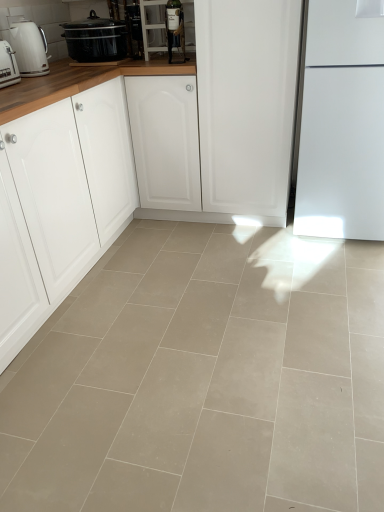
How much space does matte glass wine bottle at upper center, which ranks as the second appliance in left-to-right order, occupy horizontally?

matte glass wine bottle at upper center, which ranks as the second appliance in left-to-right order, is 5.81 inches wide.

This screenshot has height=512, width=384. Identify the location of matte black slow cooker at upper left. (96, 39).

This screenshot has width=384, height=512. What do you see at coordinates (72, 181) in the screenshot? I see `white matte cabinet at left` at bounding box center [72, 181].

In order to click on white glossy kettle at left, the 1th kitchen appliance from the back in this screenshot , I will do `click(29, 47)`.

Is matte glass wine bottle at upper center, which ranks as the second appliance in left-to-right order, far away from matte black slow cooker at upper left?

No, matte glass wine bottle at upper center, which ranks as the second appliance in left-to-right order, is in close proximity to matte black slow cooker at upper left.

Identify the location of appliance in front of the matte black slow cooker at upper left. Image resolution: width=384 pixels, height=512 pixels. (175, 28).

Is matte glass wine bottle at upper center, arranged as the second appliance when viewed from the back, facing away from matte black slow cooker at upper left?

That's not correct — matte glass wine bottle at upper center, arranged as the second appliance when viewed from the back, is not looking away from matte black slow cooker at upper left.

Measure the distance between matte glass wine bottle at upper center, placed as the 1th appliance when sorted from right to left, and matte black slow cooker at upper left.

matte glass wine bottle at upper center, placed as the 1th appliance when sorted from right to left, and matte black slow cooker at upper left are 15.88 inches apart from each other.

Identify the location of the 2nd kitchen appliance above the beige tile floor at center (from the image's perspective). (29, 47).

Does beige tile floor at center appear on the right side of white glossy kettle at left, the 1th kitchen appliance from the back?

Correct, you'll find beige tile floor at center to the right of white glossy kettle at left, the 1th kitchen appliance from the back.

Is beige tile floor at center in contact with white glossy kettle at left, arranged as the second kitchen appliance when viewed from the front?

beige tile floor at center and white glossy kettle at left, arranged as the second kitchen appliance when viewed from the front, are not in contact.

Consider the image. Considering the sizes of objects matte glass wine bottle at upper center, placed as the 1th appliance when sorted from right to left, and metallic glass bottle at upper center, placed as the 1th appliance when sorted from back to front, in the image provided, who is smaller, matte glass wine bottle at upper center, placed as the 1th appliance when sorted from right to left, or metallic glass bottle at upper center, placed as the 1th appliance when sorted from back to front,?

Smaller between the two is metallic glass bottle at upper center, placed as the 1th appliance when sorted from back to front.

Considering the sizes of objects matte glass wine bottle at upper center, placed as the 1th appliance when sorted from right to left, and metallic glass bottle at upper center, the 1th appliance when ordered from left to right, in the image provided, who is thinner, matte glass wine bottle at upper center, placed as the 1th appliance when sorted from right to left, or metallic glass bottle at upper center, the 1th appliance when ordered from left to right,?

metallic glass bottle at upper center, the 1th appliance when ordered from left to right, is thinner.

Locate an element on the screen. This screenshot has height=512, width=384. appliance on the right of metallic glass bottle at upper center, the 1th appliance when ordered from left to right is located at coordinates (175, 28).

Can you confirm if matte glass wine bottle at upper center, the first appliance viewed from the front, is taller than metallic glass bottle at upper center, the 1th appliance when ordered from left to right?

Yes.

Does beige tile floor at center appear on the left side of white plastic toaster at left, arranged as the 1th kitchen appliance when viewed from the front?

In fact, beige tile floor at center is to the right of white plastic toaster at left, arranged as the 1th kitchen appliance when viewed from the front.

Consider the image. How different are the orientations of beige tile floor at center and white plastic toaster at left, arranged as the 1th kitchen appliance when viewed from the front, in degrees?

91.3 degrees separate the facing orientations of beige tile floor at center and white plastic toaster at left, arranged as the 1th kitchen appliance when viewed from the front.

Who is more distant, beige tile floor at center or white plastic toaster at left, placed as the 2th kitchen appliance when sorted from back to front?

white plastic toaster at left, placed as the 2th kitchen appliance when sorted from back to front, is further away from the camera.

Which of these two, beige tile floor at center or white plastic toaster at left, placed as the 2th kitchen appliance when sorted from back to front, is smaller?

white plastic toaster at left, placed as the 2th kitchen appliance when sorted from back to front, is smaller.

From the image's perspective, would you say white plastic toaster at left, arranged as the 1th kitchen appliance when viewed from the front, is shown under matte black slow cooker at upper left?

Indeed, from the image's perspective, white plastic toaster at left, arranged as the 1th kitchen appliance when viewed from the front, is shown beneath matte black slow cooker at upper left.

What are the coordinates of `home appliance that appears above the white plastic toaster at left, placed as the 2th kitchen appliance when sorted from back to front (from a real-world perspective)` in the screenshot? It's located at (96, 39).

Between white plastic toaster at left, placed as the 2th kitchen appliance when sorted from back to front, and matte black slow cooker at upper left, which one has larger size?

With larger size is matte black slow cooker at upper left.

Considering the sizes of matte black slow cooker at upper left and beige tile floor at center in the image, is matte black slow cooker at upper left taller or shorter than beige tile floor at center?

Considering their sizes, matte black slow cooker at upper left has more height than beige tile floor at center.

From a real-world perspective, is matte black slow cooker at upper left beneath beige tile floor at center?

Actually, matte black slow cooker at upper left is physically above beige tile floor at center in the real world.

Which of these two, matte black slow cooker at upper left or beige tile floor at center, is bigger?

beige tile floor at center is bigger.

Does point (104, 31) come farther from viewer compared to point (91, 313)?

That is True.

Looking at this image, does matte glass wine bottle at upper center, arranged as the second appliance when viewed from the back, have a smaller size compared to white plastic toaster at left, placed as the 2th kitchen appliance when sorted from back to front?

Actually, matte glass wine bottle at upper center, arranged as the second appliance when viewed from the back, might be larger than white plastic toaster at left, placed as the 2th kitchen appliance when sorted from back to front.

Could you tell me if matte glass wine bottle at upper center, placed as the 1th appliance when sorted from right to left, is facing white plastic toaster at left, placed as the 2th kitchen appliance when sorted from back to front?

No, matte glass wine bottle at upper center, placed as the 1th appliance when sorted from right to left, is not aimed at white plastic toaster at left, placed as the 2th kitchen appliance when sorted from back to front.

From the image's perspective, would you say matte glass wine bottle at upper center, arranged as the second appliance when viewed from the back, is positioned over white plastic toaster at left, arranged as the 1th kitchen appliance when viewed from the front?

Yes, from the image's perspective, matte glass wine bottle at upper center, arranged as the second appliance when viewed from the back, is on top of white plastic toaster at left, arranged as the 1th kitchen appliance when viewed from the front.

Between matte glass wine bottle at upper center, the first appliance viewed from the front, and white plastic toaster at left, placed as the 2th kitchen appliance when sorted from back to front, which one has more height?

matte glass wine bottle at upper center, the first appliance viewed from the front, is taller.

From the matte black slow cooker at upper left, count 2nd appliance to the right and point to it. Please provide its 2D coordinates.

[(175, 28)]

Image resolution: width=384 pixels, height=512 pixels. Identify the location of concrete below the white glossy kettle at left, the 1th kitchen appliance from the back (from the image's perspective). (204, 378).

From the picture: From the image, which object appears to be farther from white glossy kettle at left, arranged as the second kitchen appliance when viewed from the front, white matte cabinet at left or matte black slow cooker at upper left?

Among the two, white matte cabinet at left is located further to white glossy kettle at left, arranged as the second kitchen appliance when viewed from the front.

Considering their positions, is white plastic toaster at left, placed as the 2th kitchen appliance when sorted from back to front, positioned closer to white matte cabinet at left than matte glass wine bottle at upper center, placed as the 1th appliance when sorted from right to left?

Based on the image, white plastic toaster at left, placed as the 2th kitchen appliance when sorted from back to front, appears to be nearer to white matte cabinet at left.

Considering their positions, is matte glass wine bottle at upper center, which ranks as the second appliance in left-to-right order, positioned closer to white glossy kettle at left, the 1th kitchen appliance from the back, than matte black slow cooker at upper left?

matte black slow cooker at upper left lies closer to white glossy kettle at left, the 1th kitchen appliance from the back, than the other object.

From the image, which object appears to be farther from metallic glass bottle at upper center, placed as the 1th appliance when sorted from back to front, white matte cabinet at left or white glossy kettle at left, arranged as the second kitchen appliance when viewed from the front?

white matte cabinet at left is positioned further to the anchor metallic glass bottle at upper center, placed as the 1th appliance when sorted from back to front.

Which object lies further to the anchor point white glossy kettle at left, arranged as the second kitchen appliance when viewed from the front, beige tile floor at center or metallic glass bottle at upper center, the 2th appliance when ordered from right to left?

beige tile floor at center is positioned further to the anchor white glossy kettle at left, arranged as the second kitchen appliance when viewed from the front.

Based on their spatial positions, is matte glass wine bottle at upper center, which ranks as the second appliance in left-to-right order, or white glossy kettle at left, the 1th kitchen appliance from the back, further from beige tile floor at center?

Among the two, matte glass wine bottle at upper center, which ranks as the second appliance in left-to-right order, is located further to beige tile floor at center.

Based on their spatial positions, is white glossy kettle at left, arranged as the second kitchen appliance when viewed from the front, or white plastic toaster at left, placed as the 2th kitchen appliance when sorted from back to front, closer to beige tile floor at center?

Based on the image, white plastic toaster at left, placed as the 2th kitchen appliance when sorted from back to front, appears to be nearer to beige tile floor at center.

Considering their positions, is white plastic toaster at left, placed as the 2th kitchen appliance when sorted from back to front, positioned further to white matte cabinet at left than matte black slow cooker at upper left?

matte black slow cooker at upper left is further to white matte cabinet at left.

The height and width of the screenshot is (512, 384). I want to click on home appliance located between white glossy kettle at left, the 1th kitchen appliance from the back, and metallic glass bottle at upper center, the 2th appliance when ordered from right to left, in the depth direction, so click(x=96, y=39).

You are a GUI agent. You are given a task and a screenshot of the screen. Output one action in this format:
    pyautogui.click(x=<x>, y=<y>)
    Task: Click on the kitchen appliance between white glossy kettle at left, arranged as the second kitchen appliance when viewed from the front, and beige tile floor at center in the up-down direction
    The image size is (384, 512).
    Given the screenshot: What is the action you would take?
    pyautogui.click(x=8, y=66)

What are the coordinates of `kitchen appliance between white matte cabinet at left and white glossy kettle at left, arranged as the second kitchen appliance when viewed from the front, in the front-back direction` in the screenshot? It's located at (8, 66).

Find the location of a particular element. cabinetry between white glossy kettle at left, arranged as the second kitchen appliance when viewed from the front, and beige tile floor at center vertically is located at coordinates (72, 181).